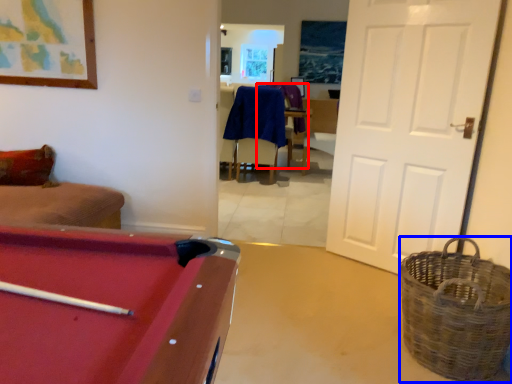
Question: Which of the following is the closest to the observer, armchair (highlighted by a red box) or basket (highlighted by a blue box)?

Choices:
 (A) armchair
 (B) basket

Answer: (B)